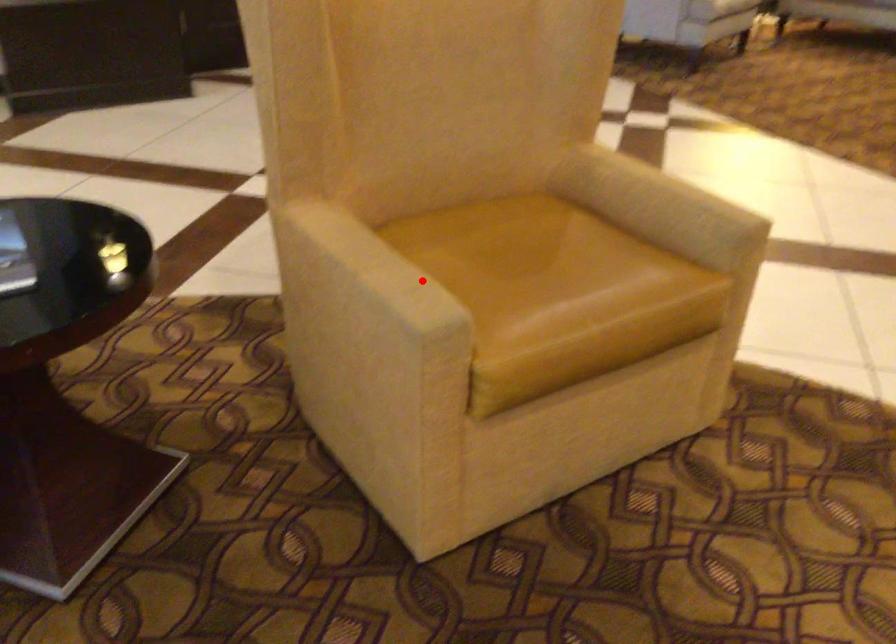
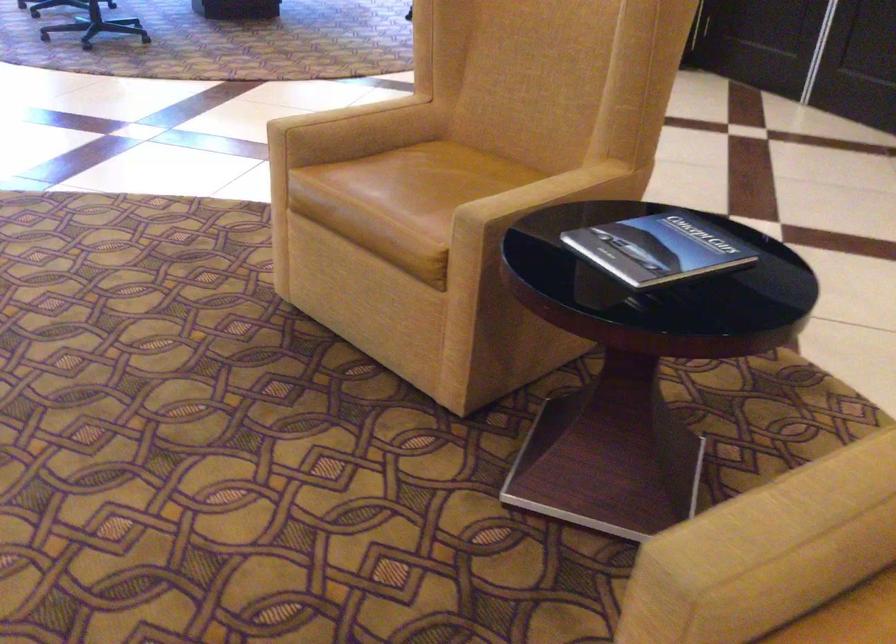
Where in the second image is the point corresponding to the highlighted location from the first image?

(778, 543)